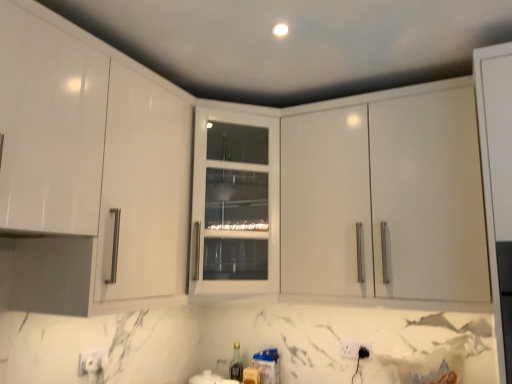
Question: Should I look upward or downward to see white glass cabinet at center, arranged as the first cabinetry when viewed from the left?

Choices:
 (A) up
 (B) down

Answer: (B)

Question: Could white plastic electric outlet at lower center, which is the second electric outlet from front to back, be considered to be inside white plastic electric outlet at lower center, acting as the 2th electric outlet starting from the back?

Choices:
 (A) yes
 (B) no

Answer: (B)

Question: Does white plastic electric outlet at lower center, acting as the 2th electric outlet starting from the back, have a lesser width compared to white plastic electric outlet at lower center, which is the 1th electric outlet from back to front?

Choices:
 (A) no
 (B) yes

Answer: (A)

Question: Does white plastic electric outlet at lower center, acting as the 2th electric outlet starting from the back, appear on the right side of white plastic electric outlet at lower center, which is the second electric outlet from front to back?

Choices:
 (A) no
 (B) yes

Answer: (B)

Question: Is white plastic electric outlet at lower center, arranged as the first electric outlet when viewed from the front, at the left side of white plastic electric outlet at lower center, which is the 1th electric outlet from back to front?

Choices:
 (A) no
 (B) yes

Answer: (A)

Question: From the image's perspective, is white plastic electric outlet at lower center, arranged as the first electric outlet when viewed from the front, beneath white plastic electric outlet at lower center, which is the second electric outlet from front to back?

Choices:
 (A) no
 (B) yes

Answer: (A)

Question: Is white plastic electric outlet at lower center, acting as the 2th electric outlet starting from the back, shorter than white plastic electric outlet at lower center, which is the second electric outlet from front to back?

Choices:
 (A) no
 (B) yes

Answer: (B)

Question: Can you confirm if white plastic electric outlet at lower center, which is the 1th electric outlet from back to front, is taller than white glass cabinet at center, arranged as the first cabinetry when viewed from the left?

Choices:
 (A) yes
 (B) no

Answer: (B)

Question: From the image's perspective, is white plastic electric outlet at lower center, which is the second electric outlet from front to back, located beneath white glass cabinet at center, the 2th cabinetry in the right-to-left sequence?

Choices:
 (A) no
 (B) yes

Answer: (B)

Question: Is white plastic electric outlet at lower center, which is the second electric outlet from front to back, shorter than white glass cabinet at center, the 2th cabinetry in the right-to-left sequence?

Choices:
 (A) no
 (B) yes

Answer: (B)

Question: Is white plastic electric outlet at lower center, which is the second electric outlet from front to back, positioned in front of white glass cabinet at center, the 2th cabinetry in the right-to-left sequence?

Choices:
 (A) yes
 (B) no

Answer: (B)

Question: Is white plastic electric outlet at lower center, which is the second electric outlet from front to back, bigger than white glass cabinet at center, the 2th cabinetry in the right-to-left sequence?

Choices:
 (A) yes
 (B) no

Answer: (B)

Question: Does white plastic electric outlet at lower center, which is the second electric outlet from front to back, have a smaller size compared to white glass cabinet at center, arranged as the first cabinetry when viewed from the left?

Choices:
 (A) yes
 (B) no

Answer: (A)

Question: Can you confirm if glossy white cabinet at upper right, marked as the first cabinetry in a right-to-left arrangement, is shorter than white plastic electric outlet at lower center, arranged as the first electric outlet when viewed from the front?

Choices:
 (A) yes
 (B) no

Answer: (B)